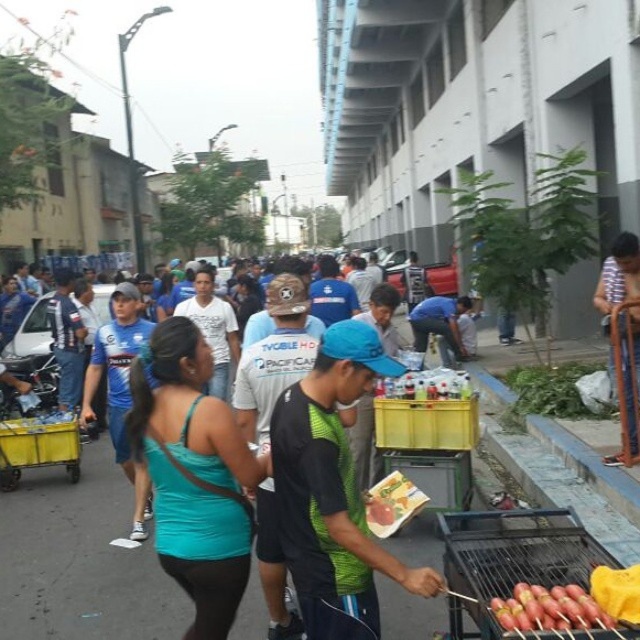
In the scene shown: Is black fabric shirt at center bigger than smooth plastic baguette at center?

Yes.

This screenshot has width=640, height=640. Identify the location of black fabric shirt at center. (332, 492).

Can you confirm if black fabric shirt at center is bigger than metallic grill at lower right?

No.

Can you confirm if black fabric shirt at center is thinner than metallic grill at lower right?

Incorrect, black fabric shirt at center's width is not less than metallic grill at lower right's.

Find the location of `black fabric shirt at center`. black fabric shirt at center is located at coordinates (332, 492).

Which is above, metallic grill at lower right or yellow plastic cart at lower left?

Positioned higher is metallic grill at lower right.

Who is more forward, (481, 563) or (68, 452)?

Point (481, 563) is in front.

Who is more distant from viewer, (x=579, y=532) or (x=70, y=429)?

The point (x=70, y=429) is more distant.

You are a GUI agent. You are given a task and a screenshot of the screen. Output one action in this format:
    pyautogui.click(x=<x>, y=<y>)
    Task: Click on the metallic grill at lower right
    The width and height of the screenshot is (640, 640).
    Given the screenshot: What is the action you would take?
    pyautogui.click(x=512, y=560)